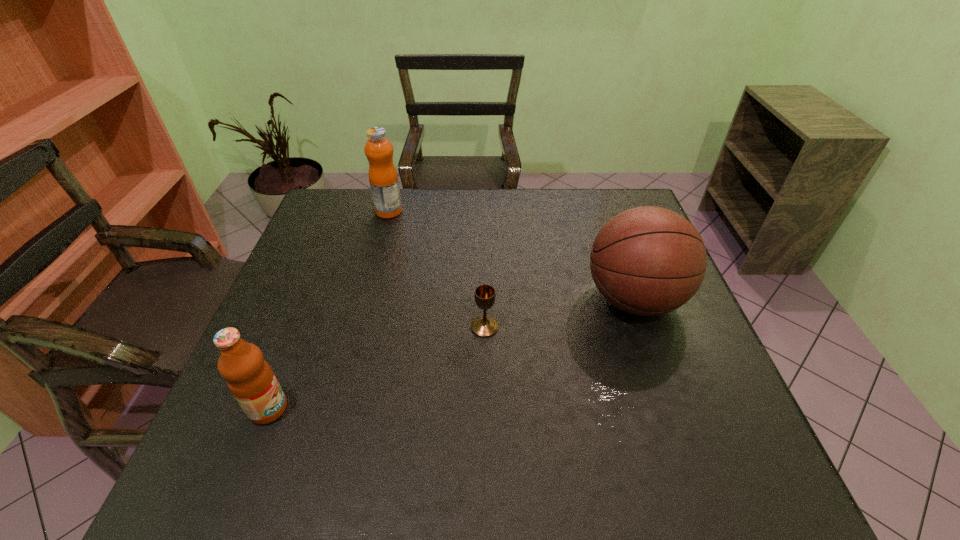
Where is `object that is the closest to the second object from right to left`? Image resolution: width=960 pixels, height=540 pixels. object that is the closest to the second object from right to left is located at coordinates (648, 260).

Identify the location of object that is the closest to the rightmost object. The height and width of the screenshot is (540, 960). (485, 295).

Identify the location of free space that satisfies the following two spatial constraints: 1. on the front side of the rightmost object; 2. on the front label of the leftmost object. (672, 409).

Locate an element on the screen. Image resolution: width=960 pixels, height=540 pixels. vacant space that satisfies the following two spatial constraints: 1. on the front side of the right fruit juice; 2. on the front label of the nearest object is located at coordinates (337, 409).

Where is `free spot that satisfies the following two spatial constraints: 1. on the back side of the shortest object; 2. on the left side of the basketball`? The height and width of the screenshot is (540, 960). free spot that satisfies the following two spatial constraints: 1. on the back side of the shortest object; 2. on the left side of the basketball is located at coordinates (485, 299).

Find the location of a particular element. Image resolution: width=960 pixels, height=540 pixels. vacant point that satisfies the following two spatial constraints: 1. on the front side of the shortest object; 2. on the front label of the left fruit juice is located at coordinates (486, 409).

Find the location of `free location that satisfies the following two spatial constraints: 1. on the front side of the farther fruit juice; 2. on the front label of the left fruit juice`. free location that satisfies the following two spatial constraints: 1. on the front side of the farther fruit juice; 2. on the front label of the left fruit juice is located at coordinates (337, 409).